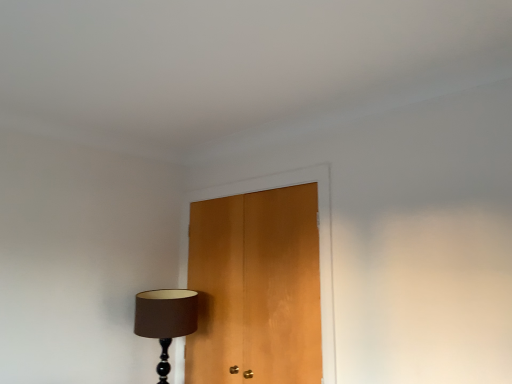
Question: Does wooden door at center touch matte brown lampshade at lower left?

Choices:
 (A) no
 (B) yes

Answer: (A)

Question: Does wooden door at center have a greater width compared to matte brown lampshade at lower left?

Choices:
 (A) yes
 (B) no

Answer: (B)

Question: From the image's perspective, would you say wooden door at center is positioned over matte brown lampshade at lower left?

Choices:
 (A) yes
 (B) no

Answer: (A)

Question: Can you confirm if wooden door at center is positioned to the right of matte brown lampshade at lower left?

Choices:
 (A) no
 (B) yes

Answer: (B)

Question: From a real-world perspective, is wooden door at center located higher than matte brown lampshade at lower left?

Choices:
 (A) yes
 (B) no

Answer: (A)

Question: Can you confirm if wooden door at center is taller than matte brown lampshade at lower left?

Choices:
 (A) no
 (B) yes

Answer: (B)

Question: From a real-world perspective, is matte brown lampshade at lower left under wooden door at center?

Choices:
 (A) no
 (B) yes

Answer: (B)

Question: Is matte brown lampshade at lower left positioned before wooden door at center?

Choices:
 (A) yes
 (B) no

Answer: (B)

Question: Is wooden door at center at the back of matte brown lampshade at lower left?

Choices:
 (A) yes
 (B) no

Answer: (B)

Question: Are matte brown lampshade at lower left and wooden door at center making contact?

Choices:
 (A) no
 (B) yes

Answer: (A)

Question: Is matte brown lampshade at lower left not within wooden door at center?

Choices:
 (A) no
 (B) yes

Answer: (B)

Question: From a real-world perspective, is matte brown lampshade at lower left located higher than wooden door at center?

Choices:
 (A) yes
 (B) no

Answer: (B)

Question: Is wooden door at center spatially inside matte brown lampshade at lower left, or outside of it?

Choices:
 (A) inside
 (B) outside

Answer: (B)